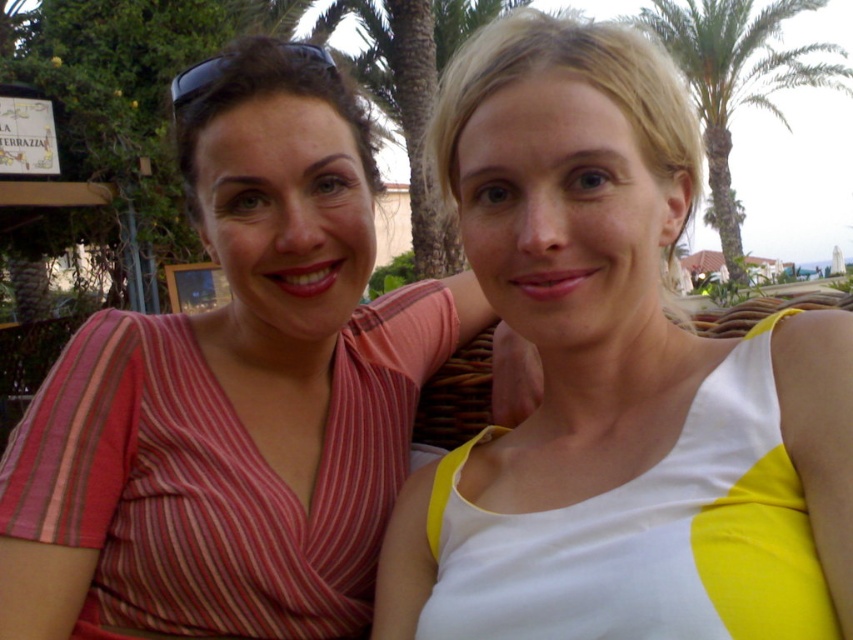
You are a photographer trying to capture a closeup of the striped fabric dress at left. Based on the coordinates provided in the Objects Description, where should you position your camera relative to the scene?

The striped fabric dress at left is located at point (235, 394), so you should position your camera closer to that coordinate to capture a closeup.

You are a photographer standing at the scene. You want to take a photo of the striped fabric dress at left and the green leafy palm tree at upper right in the same frame. Considering their distance, will you be able to capture both in a single shot without zooming in or moving your position?

The striped fabric dress at left is 18.29 meters away from the green leafy palm tree at upper right. Since the distance between them is significant, you might need to adjust your camera settings or use a wider lens to ensure both are in the frame without zooming in or moving your position.